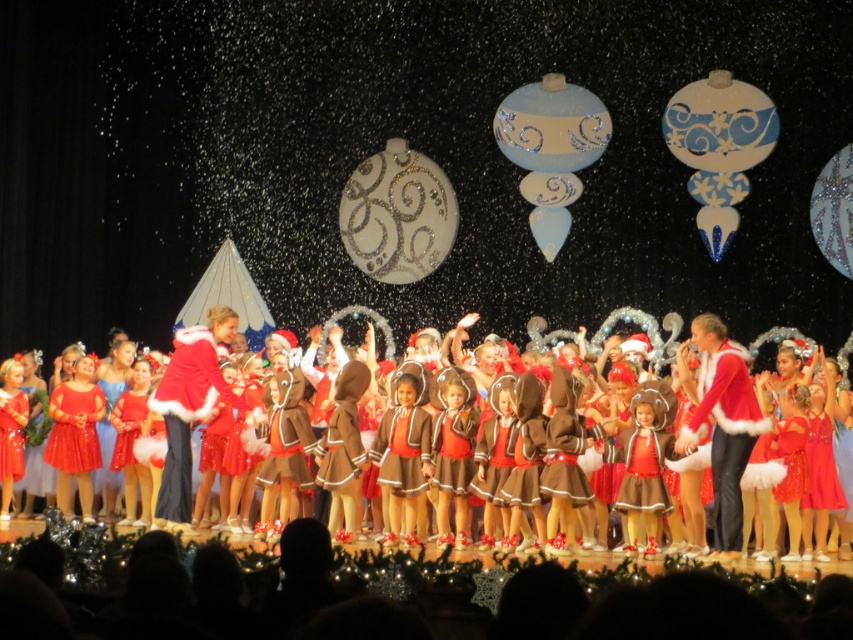
You are a photographer at the back of the stage. You want to take a photo of the shiny red dresses at center and the matte red dress at left. Which one will appear larger in the photo?

The shiny red dresses at center will appear larger in the photo because they are taller than the matte red dress at left.

You are a costume designer preparing for a stage performance. You need to ensure that the costumes are arranged properly. Given the scene described, which of the two dresses, the matte red dress at left or the shiny red dress at center, has a wider silhouette?

The matte red dress at left has a wider silhouette than the shiny red dress at center because the matte red dress at left is wider than the shiny red dress at center according to the description.